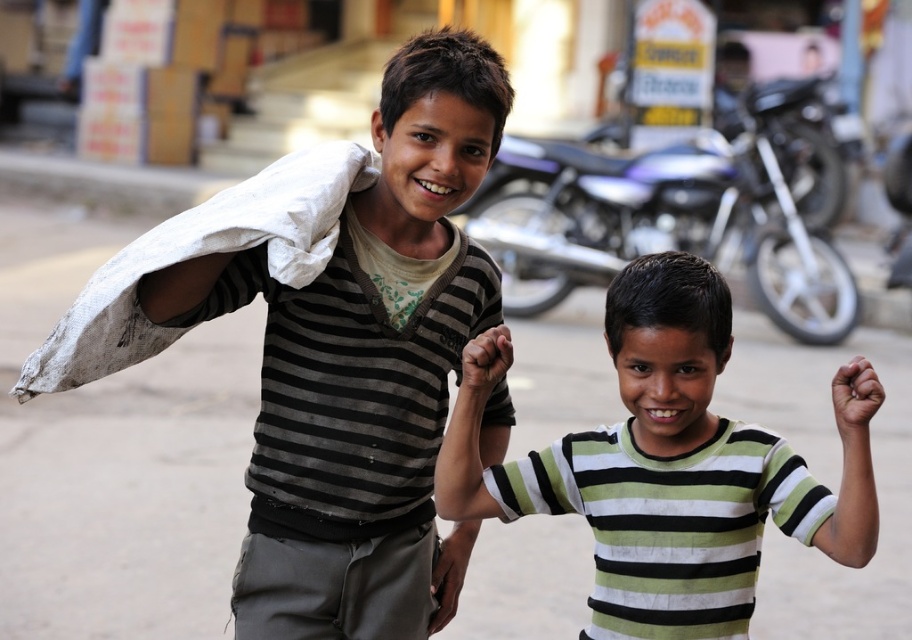
Can you confirm if metallic blue motorcycle at upper center is positioned to the right of white cotton cloth at left?

Indeed, metallic blue motorcycle at upper center is positioned on the right side of white cotton cloth at left.

Between point (602, 268) and point (333, 152), which one is positioned behind?

Point (602, 268)

Identify the location of metallic blue motorcycle at upper center. (669, 216).

Image resolution: width=912 pixels, height=640 pixels. Identify the location of metallic blue motorcycle at upper center. (669, 216).

Who is lower down, green striped shirt at center or metallic blue motorcycle at upper center?

Positioned lower is green striped shirt at center.

Does green striped shirt at center have a lesser height compared to metallic blue motorcycle at upper center?

Yes, green striped shirt at center is shorter than metallic blue motorcycle at upper center.

Which is behind, point (848, 452) or point (658, 186)?

The point (658, 186) is more distant.

Identify the location of green striped shirt at center. The width and height of the screenshot is (912, 640). (668, 465).

Is striped cotton shirt at center smaller than green striped shirt at center?

Incorrect, striped cotton shirt at center is not smaller in size than green striped shirt at center.

Can you confirm if striped cotton shirt at center is positioned to the left of green striped shirt at center?

Indeed, striped cotton shirt at center is positioned on the left side of green striped shirt at center.

Does point (368, 312) come in front of point (710, 419)?

No, it is behind (710, 419).

This screenshot has height=640, width=912. Find the location of `striped cotton shirt at center`. striped cotton shirt at center is located at coordinates (364, 368).